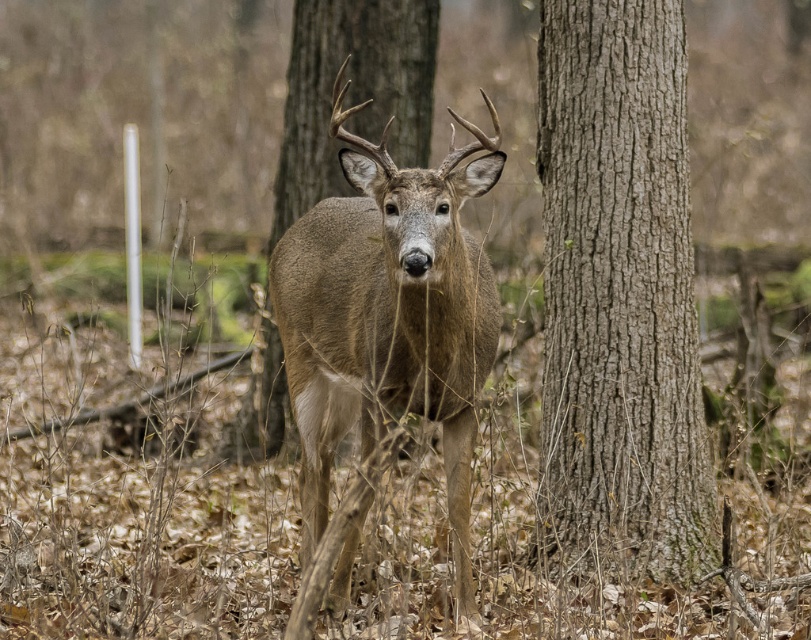
You are a nature photographer aiming to capture the brown fur deer at center while ensuring the gray textured bark at center is visible in the background. Based on their positions, which object is closer to the camera?

The brown fur deer at center is closer to the camera since the gray textured bark at center is positioned to its right, indicating it is further back.

You are a hiker who has spotted a deer in the forest. You notice a point in the image at coordinates (618,296). Based on the scene description, what is located at that point?

The point at coordinates (618,296) corresponds to gray textured bark at center.

You are a wildlife photographer aiming to capture a closeup shot of the brown fur deer at center. Your camera can focus on subjects within 3 meters. Will you need to move closer or farther away to get a clear shot?

The brown fur deer at center is 3.53 meters away from the viewer. Since your camera can focus within 3 meters, you need to move closer to the deer to get a clear shot.